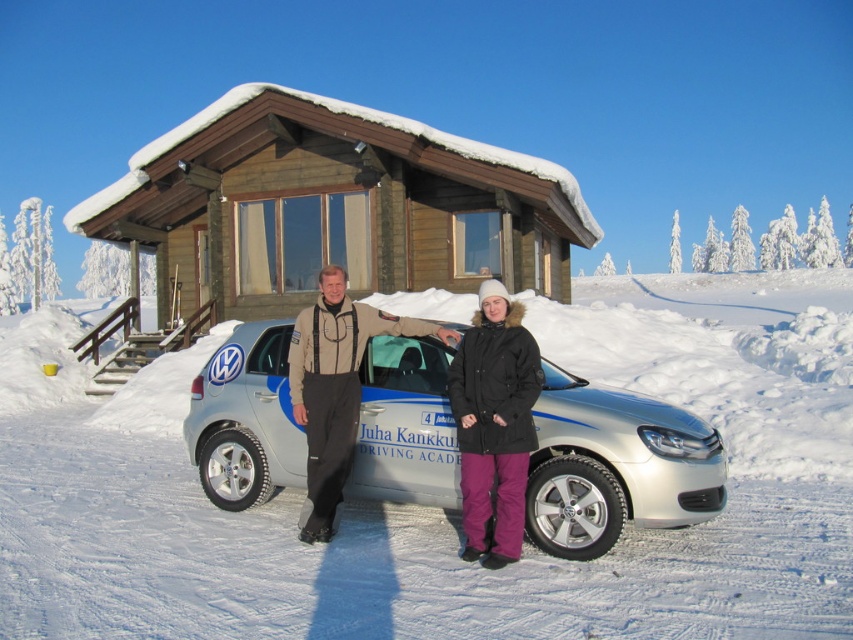
Is point (213, 432) more distant than point (498, 440)?

Yes, point (213, 432) is behind point (498, 440).

Can you confirm if silver metallic car at center is taller than purple fleece jacket at center?

No, silver metallic car at center is not taller than purple fleece jacket at center.

Locate an element on the screen. The height and width of the screenshot is (640, 853). silver metallic car at center is located at coordinates (614, 465).

How distant is black woolen hat at center from purple fleece jacket at center?

A distance of 35.65 inches exists between black woolen hat at center and purple fleece jacket at center.

Which is above, black woolen hat at center or purple fleece jacket at center?

purple fleece jacket at center is higher up.

Image resolution: width=853 pixels, height=640 pixels. What do you see at coordinates (335, 387) in the screenshot?
I see `black woolen hat at center` at bounding box center [335, 387].

Find the location of a particular element. The image size is (853, 640). black woolen hat at center is located at coordinates (335, 387).

Is point (527, 173) behind point (486, 465)?

That is True.

The width and height of the screenshot is (853, 640). Describe the element at coordinates (334, 205) in the screenshot. I see `wooden cabin at center` at that location.

Between point (231, 154) and point (468, 381), which one is positioned in front?

Positioned in front is point (468, 381).

The height and width of the screenshot is (640, 853). Identify the location of wooden cabin at center. (334, 205).